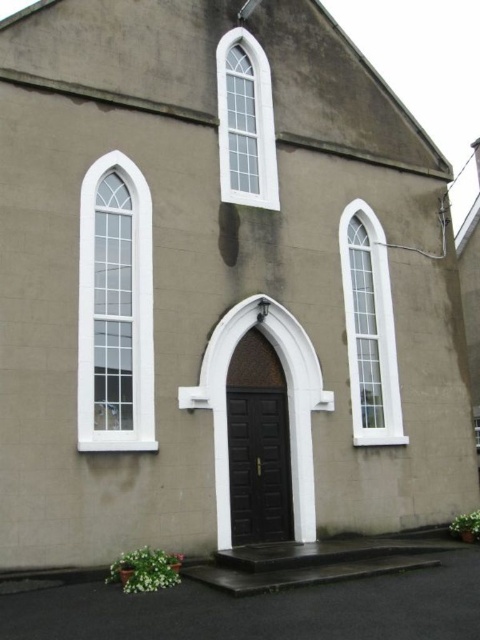
Who is taller, clear glass window at left or clear glass window at center?

With more height is clear glass window at center.

Who is more distant from viewer, (113, 259) or (343, 243)?

Point (343, 243)

Who is more forward, (x=95, y=420) or (x=348, y=209)?

Point (x=95, y=420) is in front.

Image resolution: width=480 pixels, height=640 pixels. In order to click on clear glass window at left in this screenshot , I will do `click(115, 310)`.

Which is more to the left, clear glass window at left or clear glass window at upper center?

From the viewer's perspective, clear glass window at left appears more on the left side.

Identify the location of clear glass window at left. point(115,310).

Between clear glass window at center and clear glass window at upper center, which one is positioned higher?

Positioned higher is clear glass window at upper center.

Between clear glass window at center and clear glass window at upper center, which one has less height?

clear glass window at upper center

Is point (384, 292) less distant than point (239, 80)?

That is False.

You are a GUI agent. You are given a task and a screenshot of the screen. Output one action in this format:
    pyautogui.click(x=<x>, y=<y>)
    Task: Click on the clear glass window at center
    The image size is (480, 640).
    Given the screenshot: What is the action you would take?
    tap(370, 328)